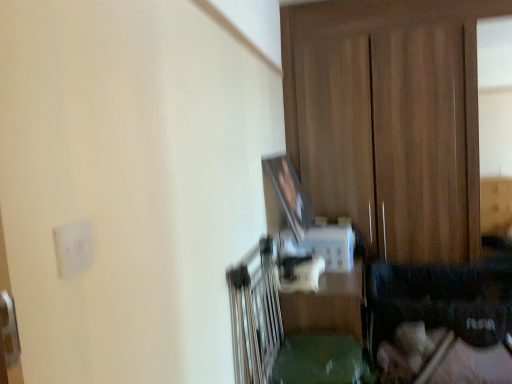
Locate an element on the screen. The height and width of the screenshot is (384, 512). wooden dresser at center is located at coordinates (383, 133).

Identify the location of wooden dresser at center. (383, 133).

Is green plastic table at center next to wooden dresser at center and touching it?

They are not placed beside each other.

Does green plastic table at center have a greater height compared to wooden dresser at center?

Incorrect, the height of green plastic table at center is not larger of that of wooden dresser at center.

What's the angular difference between green plastic table at center and wooden dresser at center's facing directions?

The facing directions of green plastic table at center and wooden dresser at center are 90.1 degrees apart.

Who is smaller, green plastic table at center or wooden dresser at center?

green plastic table at center is smaller.

Considering the relative sizes of wooden dresser at center and white matte electric outlet at upper left in the image provided, is wooden dresser at center bigger than white matte electric outlet at upper left?

Indeed, wooden dresser at center has a larger size compared to white matte electric outlet at upper left.

Can you confirm if wooden dresser at center is positioned to the right of white matte electric outlet at upper left?

Correct, you'll find wooden dresser at center to the right of white matte electric outlet at upper left.

Relative to white matte electric outlet at upper left, is wooden dresser at center in front or behind?

Clearly, wooden dresser at center is behind white matte electric outlet at upper left.

In the scene shown: Is white matte electric outlet at upper left positioned far away from wooden dresser at center?

Yes, white matte electric outlet at upper left and wooden dresser at center are quite far apart.

Can you tell me how much white matte electric outlet at upper left and wooden dresser at center differ in facing direction?

The facing directions of white matte electric outlet at upper left and wooden dresser at center are 89.7 degrees apart.

Considering the sizes of white matte electric outlet at upper left and wooden dresser at center in the image, is white matte electric outlet at upper left wider or thinner than wooden dresser at center?

Considering their sizes, white matte electric outlet at upper left looks slimmer than wooden dresser at center.

Between point (365, 141) and point (304, 322), which one is positioned in front?

Positioned in front is point (304, 322).

Is wooden dresser at center not near green plastic table at center?

Yes.

Is wooden dresser at center situated inside green plastic table at center or outside?

wooden dresser at center lies outside green plastic table at center.

Locate an element on the screen. table below the wooden dresser at center (from the image's perspective) is located at coordinates (327, 305).

Consider the image. Can you tell me how much white matte electric outlet at upper left and green plastic table at center differ in facing direction?

The angular difference between white matte electric outlet at upper left and green plastic table at center is 0.396 degrees.

Is white matte electric outlet at upper left to the right of green plastic table at center from the viewer's perspective?

In fact, white matte electric outlet at upper left is to the left of green plastic table at center.

Identify the location of table behind the white matte electric outlet at upper left. (327, 305).

Which of these two, green plastic table at center or white matte electric outlet at upper left, is smaller?

With smaller size is white matte electric outlet at upper left.

What are the coordinates of `table below the white matte electric outlet at upper left (from a real-world perspective)` in the screenshot? It's located at (327, 305).

Considering the positions of objects green plastic table at center and white matte electric outlet at upper left in the image provided, who is in front, green plastic table at center or white matte electric outlet at upper left?

white matte electric outlet at upper left is more forward.

Identify the location of table on the left of wooden dresser at center. This screenshot has height=384, width=512. (327, 305).

You are a GUI agent. You are given a task and a screenshot of the screen. Output one action in this format:
    pyautogui.click(x=<x>, y=<y>)
    Task: Click on the dresser lying behind the white matte electric outlet at upper left
    Image resolution: width=512 pixels, height=384 pixels.
    Given the screenshot: What is the action you would take?
    pyautogui.click(x=383, y=133)

Which object lies further to the anchor point green plastic table at center, wooden dresser at center or white matte electric outlet at upper left?

white matte electric outlet at upper left is further to green plastic table at center.

Estimate the real-world distances between objects in this image. Which object is further from wooden dresser at center, white matte electric outlet at upper left or green plastic table at center?

The object further to wooden dresser at center is white matte electric outlet at upper left.

From the image, which object appears to be farther from white matte electric outlet at upper left, wooden dresser at center or green plastic table at center?

wooden dresser at center.

Based on their spatial positions, is green plastic table at center or wooden dresser at center further from white matte electric outlet at upper left?

Based on the image, wooden dresser at center appears to be further to white matte electric outlet at upper left.

Which object lies nearer to the anchor point wooden dresser at center, green plastic table at center or white matte electric outlet at upper left?

green plastic table at center is positioned closer to the anchor wooden dresser at center.

When comparing their distances from green plastic table at center, does white matte electric outlet at upper left or wooden dresser at center seem closer?

wooden dresser at center.

Where is `table located between white matte electric outlet at upper left and wooden dresser at center in the depth direction`? table located between white matte electric outlet at upper left and wooden dresser at center in the depth direction is located at coordinates (327, 305).